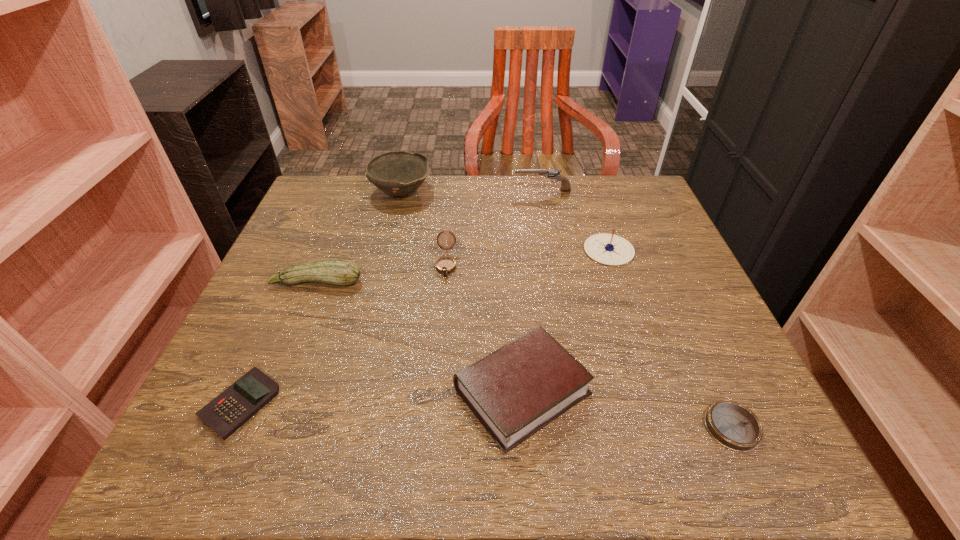
Where is `vacant space at the far edge of the desktop`? This screenshot has width=960, height=540. vacant space at the far edge of the desktop is located at coordinates click(x=444, y=208).

The image size is (960, 540). Identify the location of vacant space at the near edge of the desktop. (505, 464).

Identify the location of free space at the left edge. (235, 335).

Where is `vacant space at the right edge of the desktop`? Image resolution: width=960 pixels, height=540 pixels. vacant space at the right edge of the desktop is located at coordinates (712, 315).

In the image, there is a desktop. At what (x,y) coordinates should I click in order to perform the action: click on vacant space at the far left corner. Please return your answer as a coordinate pair (x, y). This screenshot has width=960, height=540. Looking at the image, I should click on (360, 198).

I want to click on free space at the far right corner of the desktop, so click(604, 197).

Locate an element on the screen. vacant space at the near right corner of the desktop is located at coordinates (748, 462).

Where is `vacant space in between the calculator and the leftmost compass`? vacant space in between the calculator and the leftmost compass is located at coordinates (344, 334).

The width and height of the screenshot is (960, 540). I want to click on vacant space in between the gun and the tallest object, so click(471, 191).

Locate an element on the screen. free point between the bowl and the Bible is located at coordinates (462, 292).